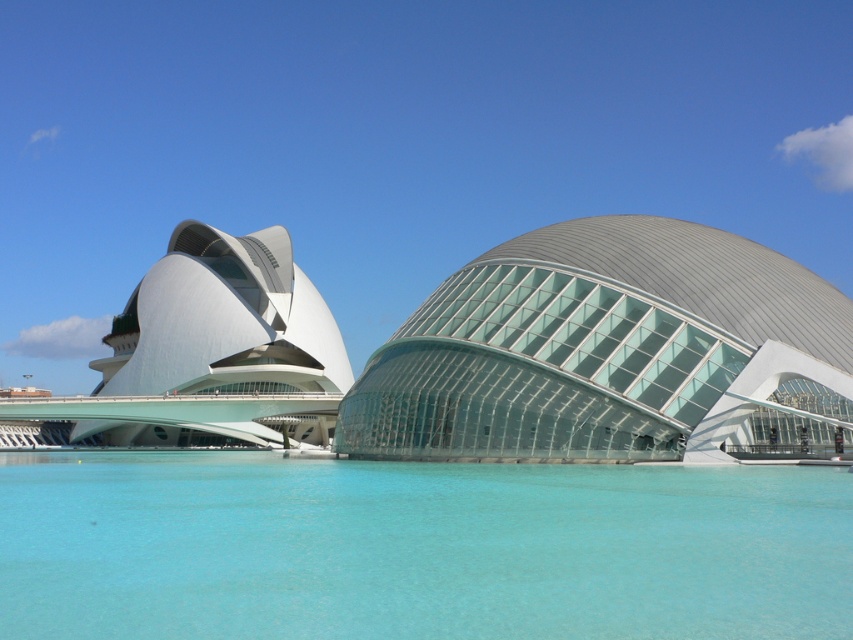
Is point (453, 540) more distant than point (682, 413)?

No, (453, 540) is in front of (682, 413).

Can you confirm if clear blue water at lower center is positioned below transparent glass dome at center?

Yes.

Who is more distant from viewer, (454, 481) or (358, 403)?

Point (358, 403)

The image size is (853, 640). Identify the location of clear blue water at lower center. (416, 548).